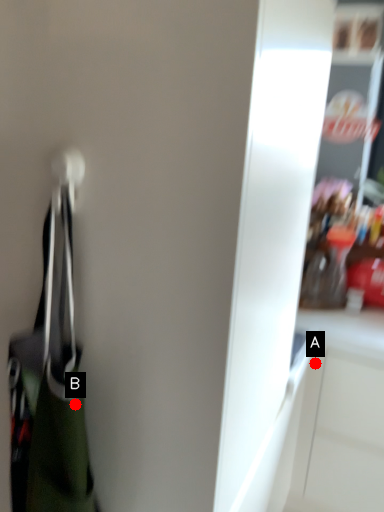
Question: Two points are circled on the image, labeled by A and B beside each circle. Which point is farther to the camera?

Choices:
 (A) A is further
 (B) B is further

Answer: (A)